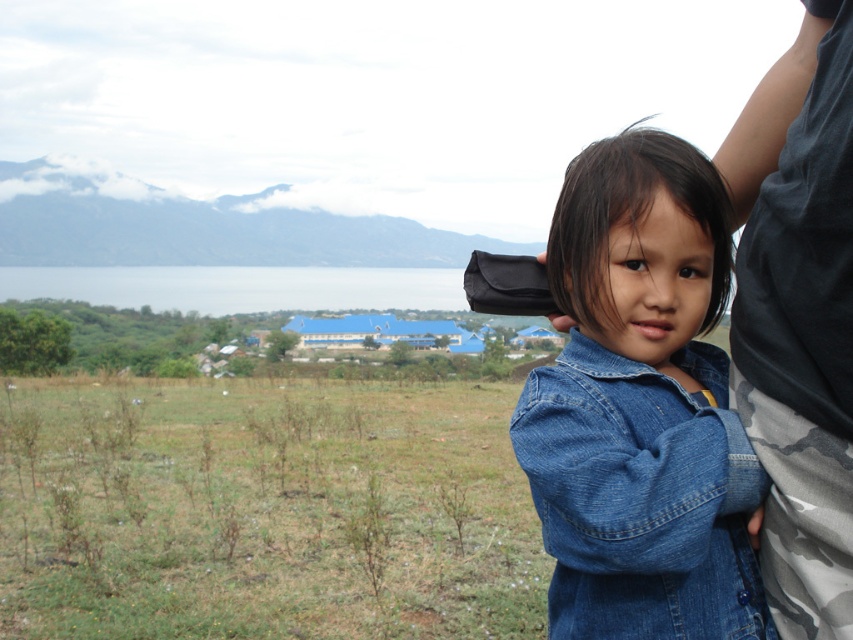
Does denim jacket at lower right have a lesser width compared to dark gray/camo-patterned pants at right?

Yes, denim jacket at lower right is thinner than dark gray/camo-patterned pants at right.

Does point (590, 518) come farther from viewer compared to point (753, 97)?

No, it is not.

Between point (624, 552) and point (828, 552), which one is positioned behind?

The point (624, 552) is more distant.

Identify the location of denim jacket at lower right. The image size is (853, 640). (641, 406).

Is point (376, 490) more distant than point (830, 476)?

Yes, point (376, 490) is farther from viewer.

Does green grass at lower left appear on the left side of dark gray/camo-patterned pants at right?

Correct, you'll find green grass at lower left to the left of dark gray/camo-patterned pants at right.

The image size is (853, 640). In order to click on green grass at lower left in this screenshot , I will do `click(264, 512)`.

From the picture: Who is shorter, green grass at lower left or denim jacket at lower right?

green grass at lower left

Does green grass at lower left have a smaller size compared to denim jacket at lower right?

Incorrect, green grass at lower left is not smaller in size than denim jacket at lower right.

This screenshot has width=853, height=640. I want to click on green grass at lower left, so click(x=264, y=512).